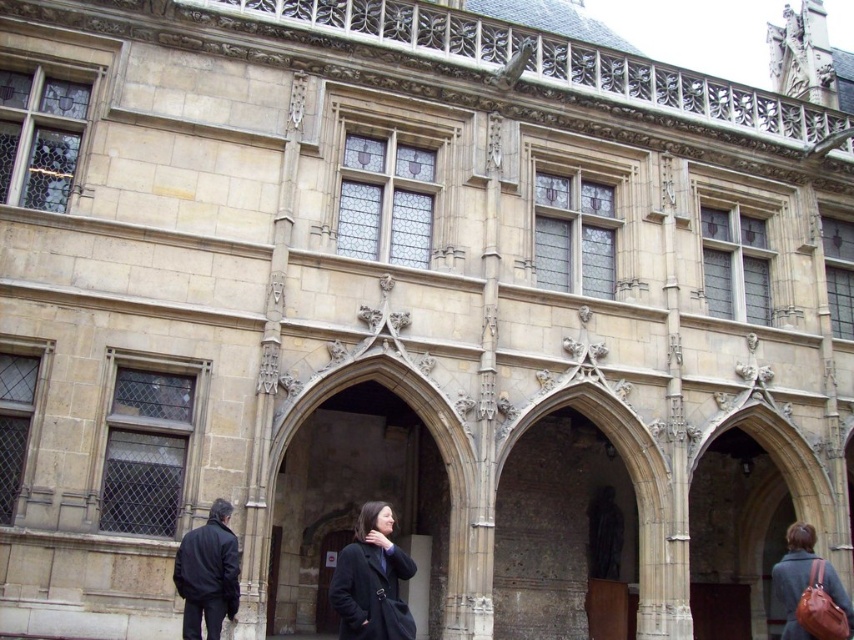
From the picture: You are a visitor standing in front of the historic building and see the black matte jacket at lower left and the brown leather bag at lower right. Which object is taller?

The brown leather bag at lower right is taller than the black matte jacket at lower left.

You are standing in front of the historic building and want to take a photo. There are two points marked on the facade at coordinates point (623,572) and point (390,593). Which point is closer to your camera lens when taking the photo?

Point (390,593) is closer to the camera lens because it is less further away than point (623,572) according to the description.

You are an architect examining the historic building. You notice the stone textured archway at center and the matte black coat at center. Which object is taller?

The stone textured archway at center is taller than the matte black coat at center.